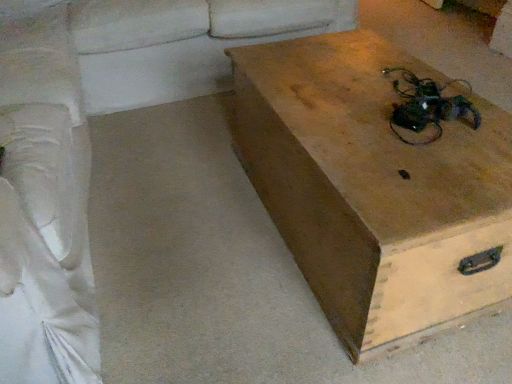
Question: From the image's perspective, relative to white fabric couch at upper left, the second couch positioned from the left, is smooth beige couch at lower left above or below?

Choices:
 (A) above
 (B) below

Answer: (B)

Question: Considering the positions of smooth beige couch at lower left and white fabric couch at upper left, the second couch positioned from the left, in the image, is smooth beige couch at lower left taller or shorter than white fabric couch at upper left, the second couch positioned from the left,?

Choices:
 (A) tall
 (B) short

Answer: (B)

Question: Estimate the real-world distances between objects in this image. Which object is closer to the white fabric couch at left, which ranks as the 1th couch in left-to-right order?

Choices:
 (A) wooden box at center
 (B) white fabric couch at upper left, which appears as the 1th couch when viewed from the right
 (C) smooth beige couch at lower left

Answer: (C)

Question: Which object is positioned closest to the white fabric couch at left, which ranks as the 1th couch in left-to-right order?

Choices:
 (A) wooden box at center
 (B) white fabric couch at upper left, the second couch positioned from the left
 (C) smooth beige couch at lower left

Answer: (C)